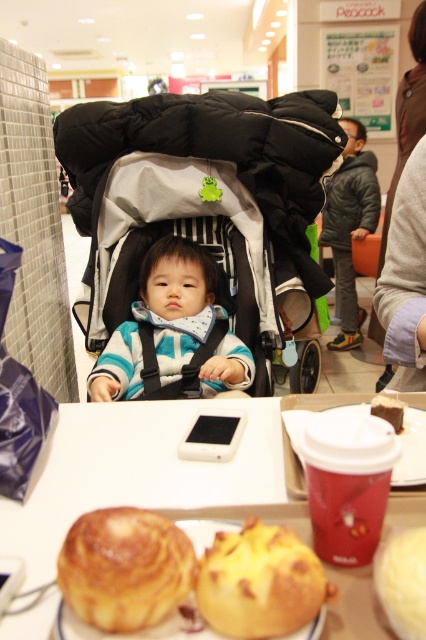
Question: Estimate the real-world distances between objects in this image. Which object is closer to the striped fabric baby at center?

Choices:
 (A) white matte table at center
 (B) golden crusty bread at center

Answer: (A)

Question: Does golden crusty bread at center have a larger size compared to yellow matte bread at center?

Choices:
 (A) no
 (B) yes

Answer: (B)

Question: Which of the following is the closest to the observer?

Choices:
 (A) golden crusty bread at center
 (B) yellow matte bread at center

Answer: (B)

Question: Which object is positioned closest to the white matte table at center?

Choices:
 (A) black fabric baby carriage at center
 (B) striped fabric baby at center

Answer: (B)

Question: Can you confirm if striped fabric baby at center is positioned to the left of yellow matte bread at center?

Choices:
 (A) no
 (B) yes

Answer: (B)

Question: Can you confirm if white matte table at center is positioned below golden crusty bread at center?

Choices:
 (A) no
 (B) yes

Answer: (A)